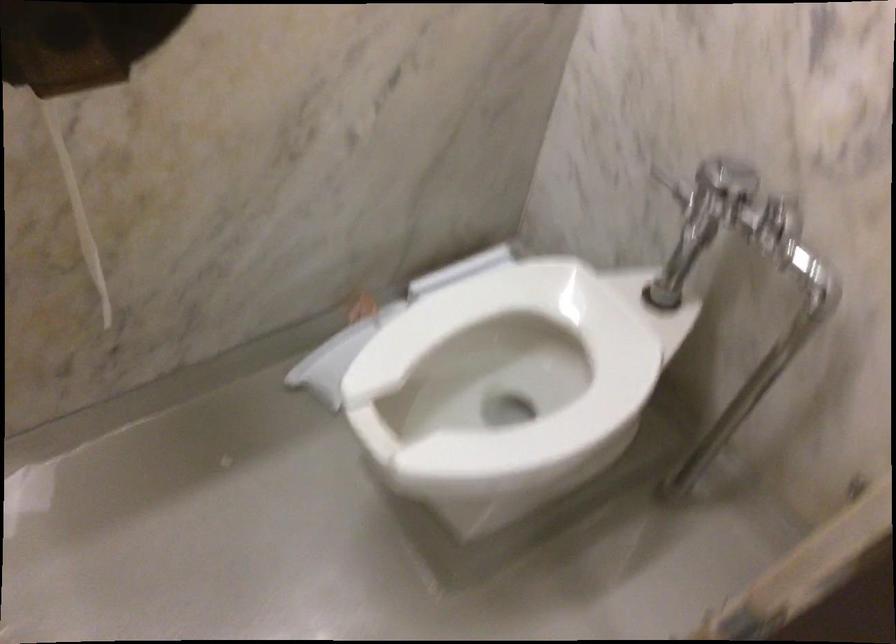
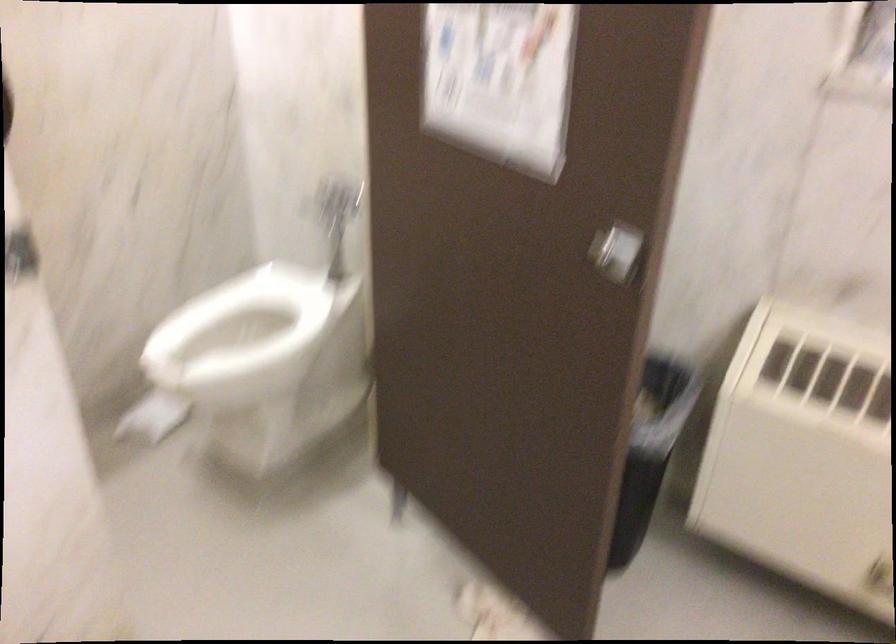
Question: In a continuous first-person perspective shot, in which direction is the camera moving?

Choices:
 (A) Left
 (B) Right
 (C) Forward
 (D) Backward

Answer: (D)